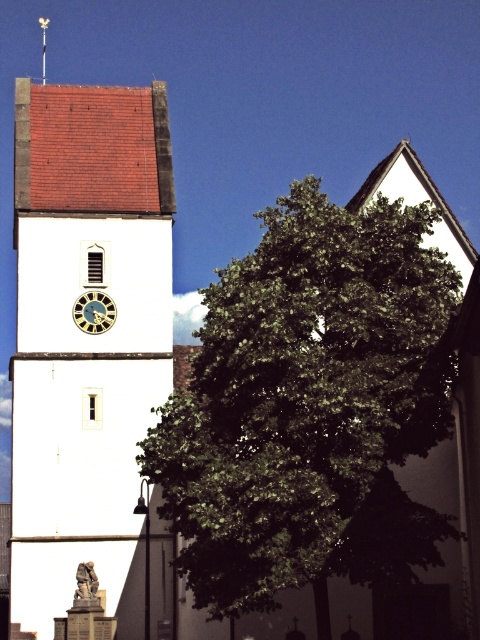
Is gold metallic clock at center positioned behind metallic spire at upper center?

No, it is in front of metallic spire at upper center.

Between gold metallic clock at center and metallic spire at upper center, which one appears on the right side from the viewer's perspective?

gold metallic clock at center is more to the right.

This screenshot has height=640, width=480. Find the location of `gold metallic clock at center`. gold metallic clock at center is located at coordinates (94, 312).

Does white smooth tower at center have a greater width compared to gold metallic clock at center?

Yes.

Between white smooth tower at center and gold metallic clock at center, which one has less height?

With less height is gold metallic clock at center.

Image resolution: width=480 pixels, height=640 pixels. Identify the location of white smooth tower at center. (84, 332).

Who is positioned more to the left, green leafy tree at center or white smooth tower at center?

white smooth tower at center is more to the left.

Does green leafy tree at center have a lesser height compared to white smooth tower at center?

Yes.

Who is more distant from viewer, (252, 468) or (146, 348)?

The point (146, 348) is behind.

The image size is (480, 640). What are the coordinates of `green leafy tree at center` in the screenshot? It's located at (311, 406).